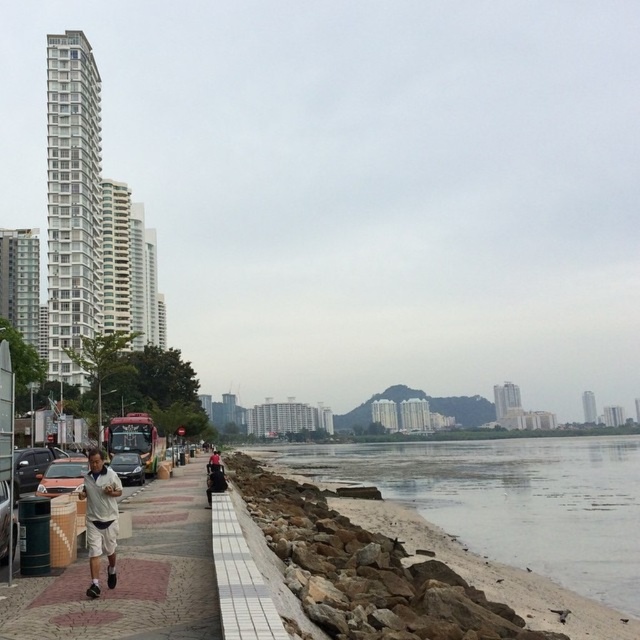
Question: Where is white tile pavement at lower left located in relation to metallic silver car at left in the image?

Choices:
 (A) below
 (B) above

Answer: (A)

Question: Which point is farther from the camera taking this photo?

Choices:
 (A) (131, 481)
 (B) (32, 460)
 (C) (333, 449)
 (D) (227, 586)

Answer: (C)

Question: Which point is closer to the camera taking this photo?

Choices:
 (A) (460, 476)
 (B) (241, 588)
 (C) (116, 612)
 (D) (61, 481)

Answer: (B)

Question: Estimate the real-world distances between objects in this image. Which object is farther from the matte black car at left?

Choices:
 (A) white tile curb at lower center
 (B) metallic silver car at left
 (C) gray rocky shore at lower left
 (D) white matte shorts at lower left

Answer: (C)

Question: Does white tile curb at lower center have a smaller size compared to matte silver sedan at center-left?

Choices:
 (A) no
 (B) yes

Answer: (A)

Question: Does matte black car at left appear on the left side of metallic silver car at left?

Choices:
 (A) no
 (B) yes

Answer: (B)